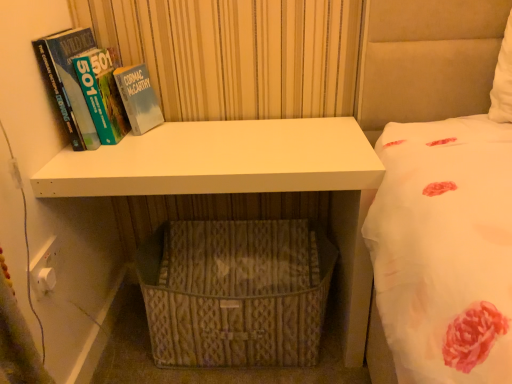
Where is `free space in front of hardcover book at left`? This screenshot has width=512, height=384. free space in front of hardcover book at left is located at coordinates (102, 168).